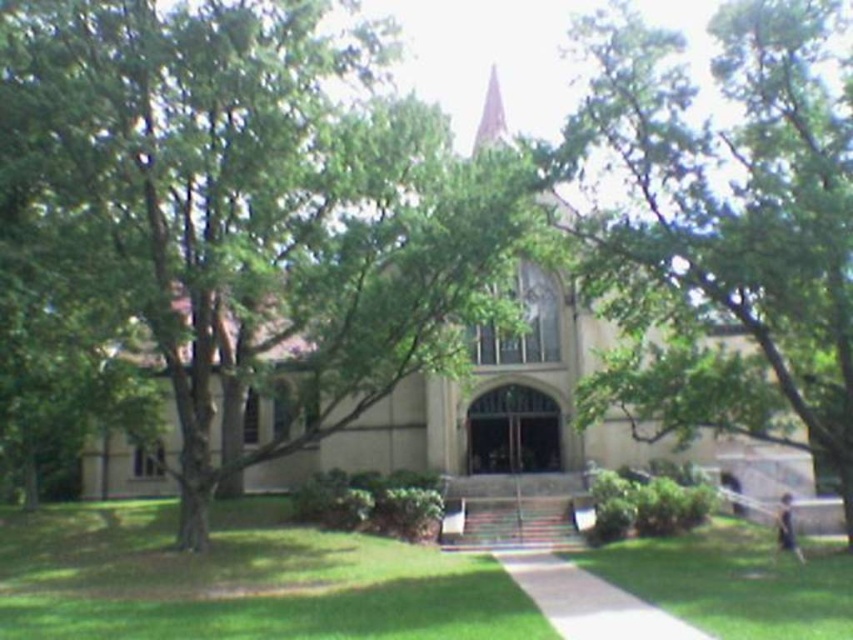
Question: Which object is positioned farthest from the green grass at center?

Choices:
 (A) beige stone church at center
 (B) light brown stone spire at upper center

Answer: (B)

Question: Where is green leafy tree at center located in relation to beige stone church at center in the image?

Choices:
 (A) above
 (B) below

Answer: (B)

Question: Does green leafy tree at center have a lesser width compared to green grass at center?

Choices:
 (A) yes
 (B) no

Answer: (A)

Question: Does green leafy tree at center have a larger size compared to beige stone church at center?

Choices:
 (A) yes
 (B) no

Answer: (B)

Question: Which object is farther from the camera taking this photo?

Choices:
 (A) light brown stone spire at upper center
 (B) beige stone church at center

Answer: (A)

Question: Estimate the real-world distances between objects in this image. Which object is farther from the beige stone church at center?

Choices:
 (A) green leafy tree at center
 (B) light brown stone spire at upper center

Answer: (B)